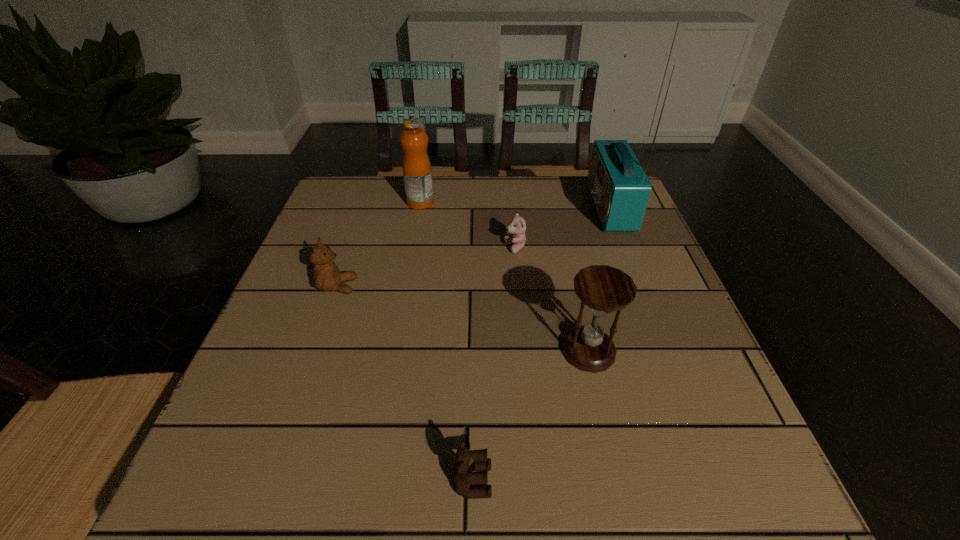
I want to click on vacant point that satisfies the following two spatial constraints: 1. on the front side of the second object from left to right; 2. on the right side of the hourglass, so click(393, 351).

Locate an element on the screen. blank space that satisfies the following two spatial constraints: 1. on the face of the second nearest teddy bear; 2. on the right side of the fourth shortest object is located at coordinates (315, 351).